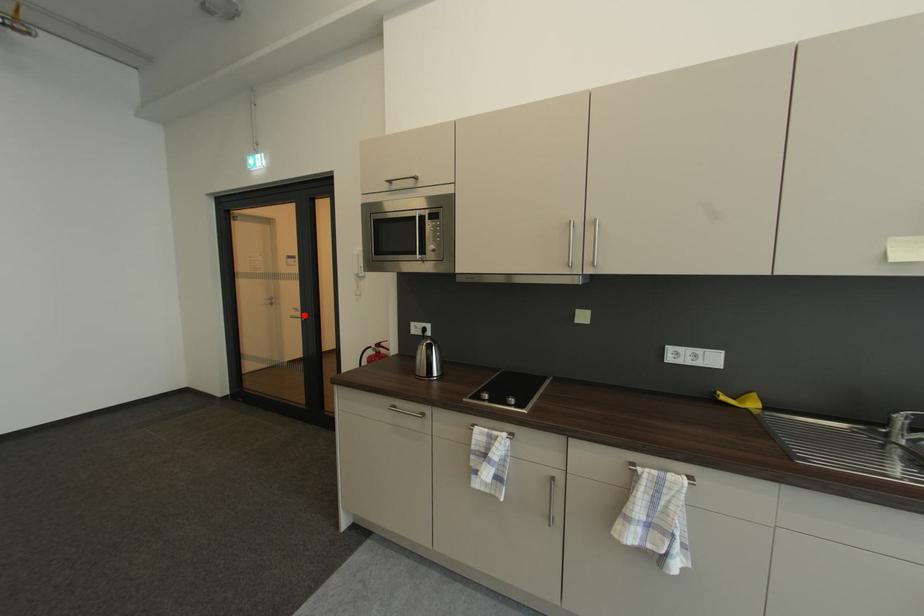
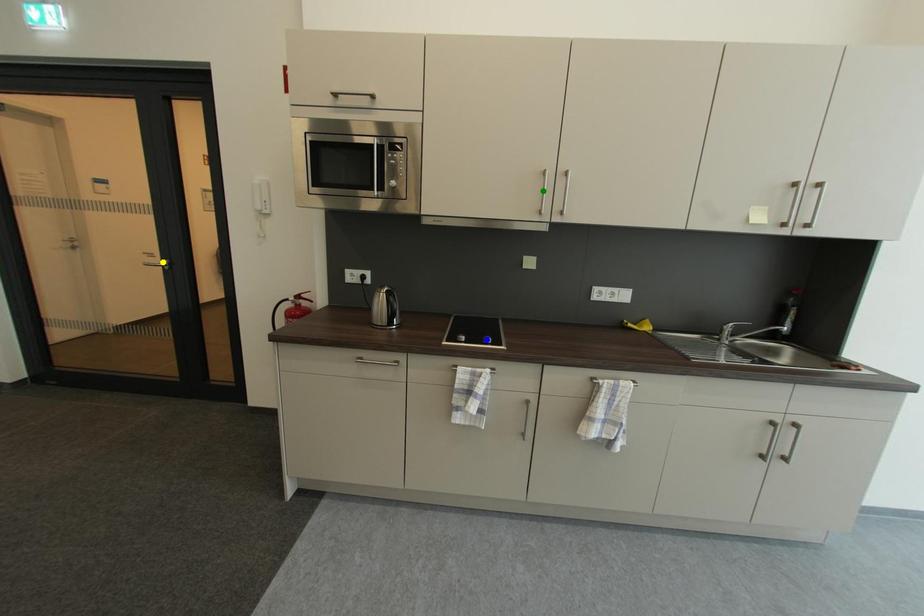
Question: I am providing you with two images of the same scene from different viewpoints. A red point is marked on the first image. You are given multiple points on the second image. Which mark in image 2 goes with the point in image 1?

Choices:
 (A) green point
 (B) yellow point
 (C) blue point

Answer: (B)